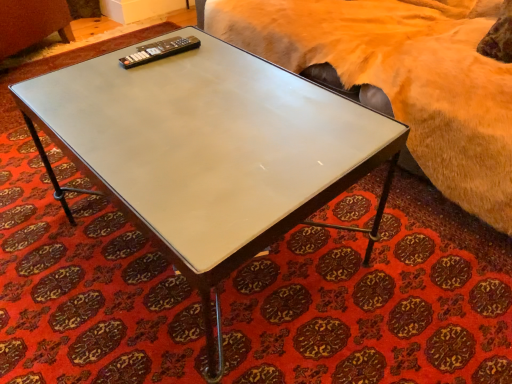
Identify the location of free space to the left of black plastic remote at upper left. The width and height of the screenshot is (512, 384). (106, 59).